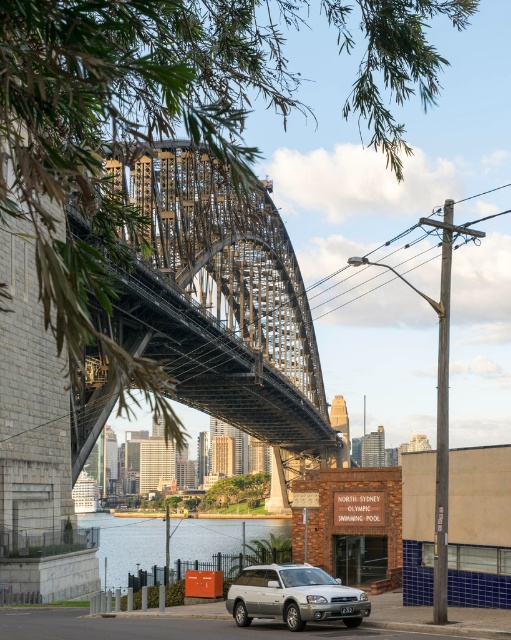
Question: Which of the following is the farthest from the observer?

Choices:
 (A) (174, 248)
 (B) (252, 572)

Answer: (A)

Question: Which of these objects is positioned closest to the metallic steel bridge at center?

Choices:
 (A) silver metallic station wagon at center
 (B) blue water at lower left

Answer: (B)

Question: Does metallic steel bridge at center appear over blue water at lower left?

Choices:
 (A) no
 (B) yes

Answer: (B)

Question: Is blue water at lower left to the right of silver metallic station wagon at center from the viewer's perspective?

Choices:
 (A) yes
 (B) no

Answer: (B)

Question: Estimate the real-world distances between objects in this image. Which object is farther from the metallic steel bridge at center?

Choices:
 (A) blue water at lower left
 (B) silver metallic station wagon at center

Answer: (B)

Question: Does blue water at lower left have a smaller size compared to silver metallic station wagon at center?

Choices:
 (A) no
 (B) yes

Answer: (A)